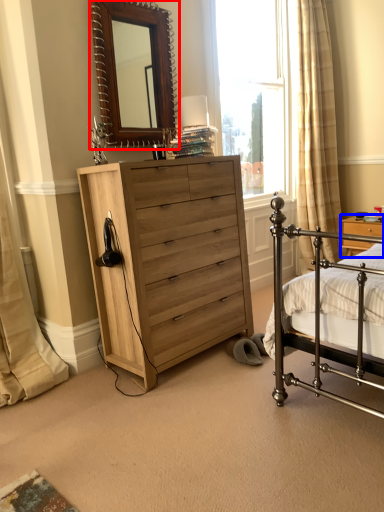
Question: Which point is closer to the camera, mirror (highlighted by a red box) or nightstand (highlighted by a blue box)?

Choices:
 (A) mirror
 (B) nightstand

Answer: (A)